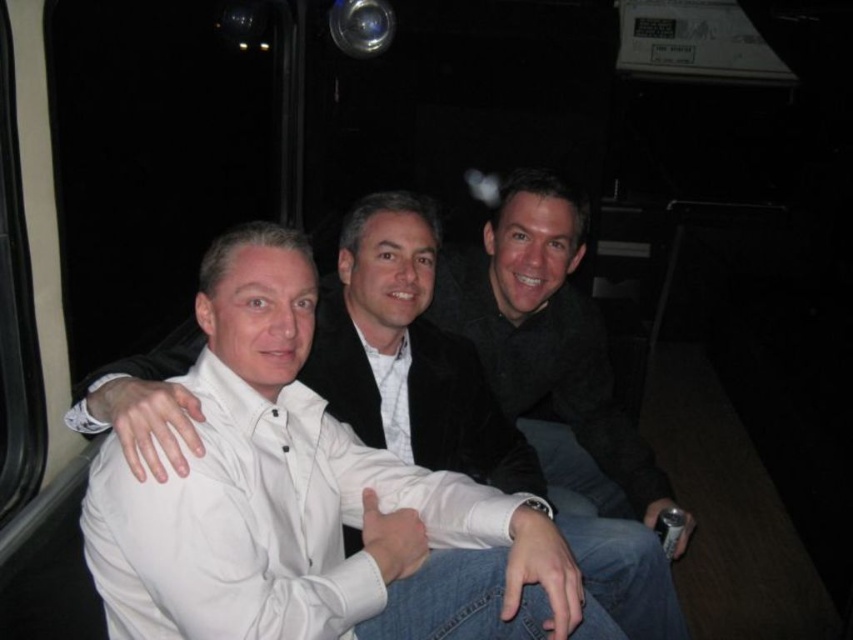
Question: Can you confirm if white matte shirt at center is positioned below black matte jacket at center?

Choices:
 (A) yes
 (B) no

Answer: (A)

Question: Can you confirm if white matte shirt at center is positioned below black matte jacket at center?

Choices:
 (A) yes
 (B) no

Answer: (A)

Question: Does white matte shirt at center appear under black matte jacket at center?

Choices:
 (A) yes
 (B) no

Answer: (A)

Question: Among these objects, which one is nearest to the camera?

Choices:
 (A) white matte shirt at center
 (B) black matte jacket at center

Answer: (A)